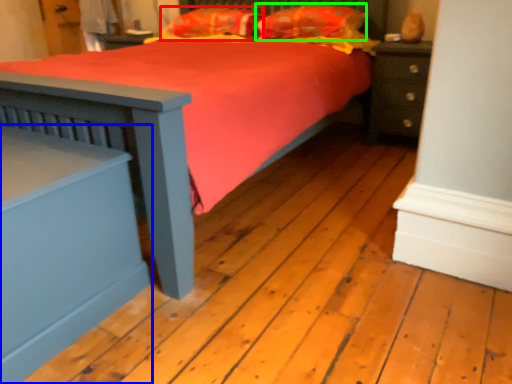
Question: Considering the real-world distances, which object is farthest from pillow (highlighted by a red box)? nightstand (highlighted by a blue box) or pillow (highlighted by a green box)?

Choices:
 (A) nightstand
 (B) pillow

Answer: (A)